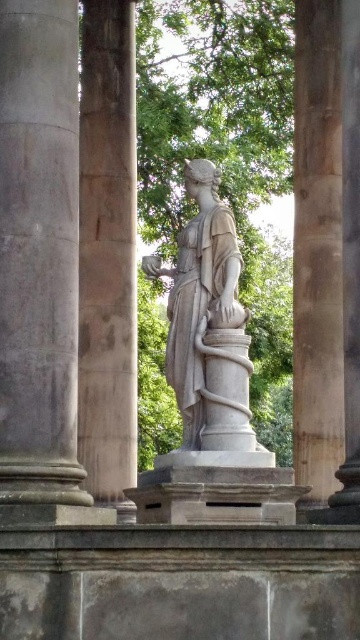
You are standing in front of the classical statue between the two columns. You notice two points on the statue. One is at coordinates point (50, 93) and the other is at point (129, 157). Which of these points is nearer to you?

Point (50, 93) is closer to the viewer than point (129, 157).

You are an architect designing a garden pathway that needs to pass between the green leafy tree at center and the smooth stone column at right. The pathway must be wide enough for a wheelchair to pass comfortably. Can you determine if the space between them is sufficient based on their heights?

The green leafy tree at center is taller than the smooth stone column at right, but height does not determine the width of the space between them. The description provided does not include information about the horizontal distance between the two objects, so it is impossible to determine if the pathway will be wide enough for a wheelchair.

You are standing in front of the classical statue between two large stone columns. There is a point marked at coordinates (x=317, y=252). Which object does this point correspond to?

The point at coordinates (x=317, y=252) corresponds to the smooth stone column at right.